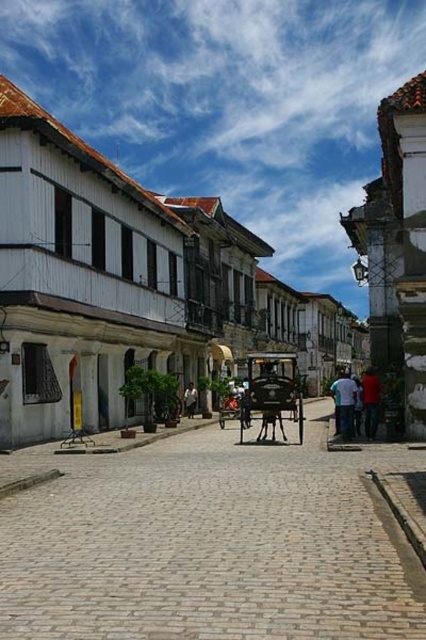
Question: Estimate the real-world distances between objects in this image. Which object is farther from the white cotton shirt at right?

Choices:
 (A) shiny black cart at center
 (B) smooth cobblestone alley at center
 (C) white wood building at center

Answer: (C)

Question: Is smooth cobblestone alley at center wider than shiny black cart at center?

Choices:
 (A) no
 (B) yes

Answer: (B)

Question: Based on their relative distances, which object is farther from the smooth cobblestone alley at center?

Choices:
 (A) white cotton shirt at right
 (B) red shirt at center
 (C) shiny black cart at center

Answer: (A)

Question: Does white wood building at center have a greater width compared to shiny black cart at center?

Choices:
 (A) yes
 (B) no

Answer: (A)

Question: Among these points, which one is farthest from the camera?

Choices:
 (A) (336, 540)
 (B) (365, 413)

Answer: (B)

Question: Is shiny black cart at center in front of red shirt at center?

Choices:
 (A) yes
 (B) no

Answer: (A)